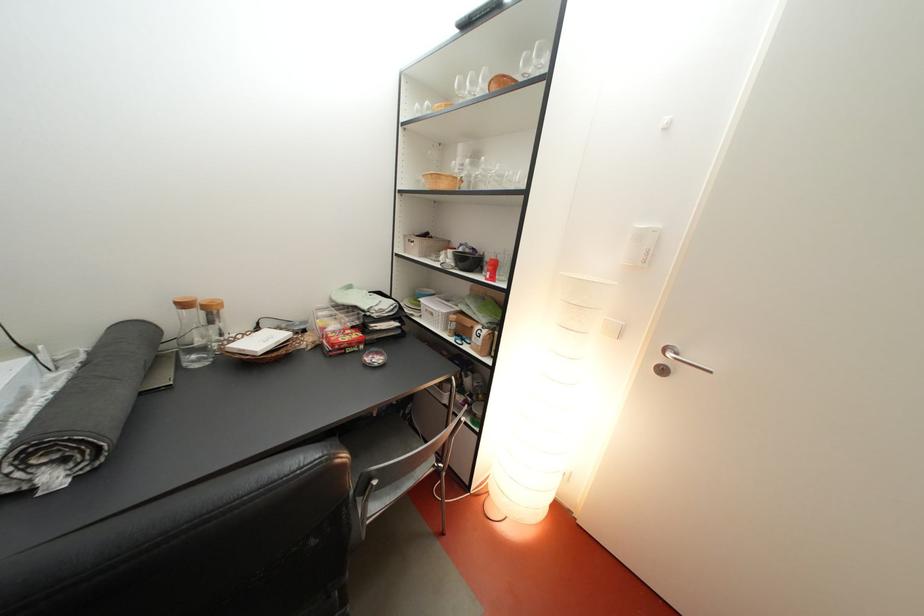
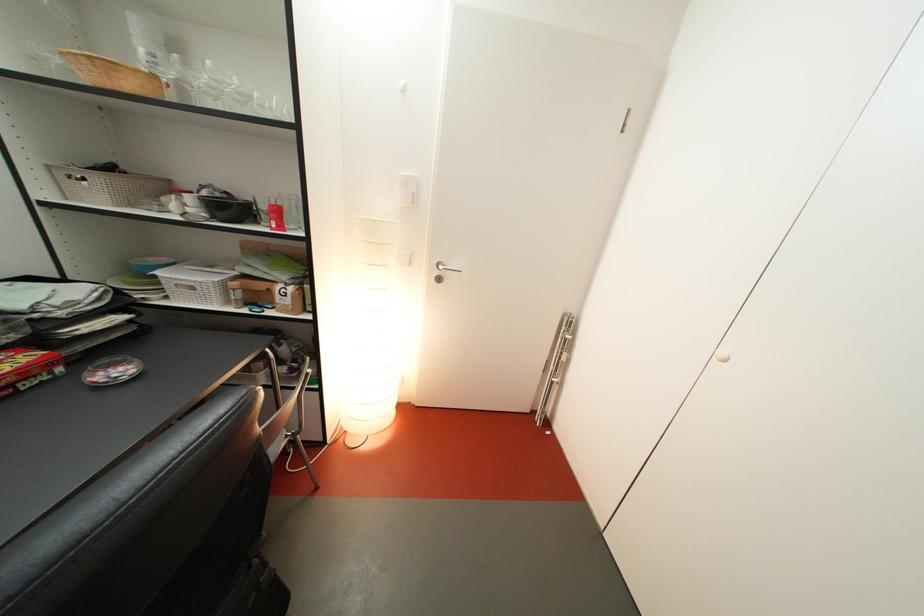
In the second image, find the point that corresponds to point (368, 342) in the first image.

(38, 363)